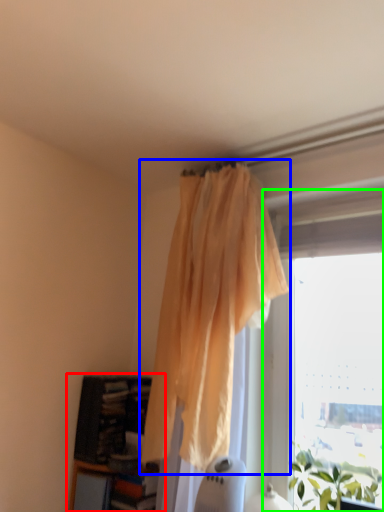
Question: Considering the real-world distances, which object is closest to bookcase (highlighted by a red box)? curtain (highlighted by a blue box) or window (highlighted by a green box).

Choices:
 (A) curtain
 (B) window

Answer: (A)